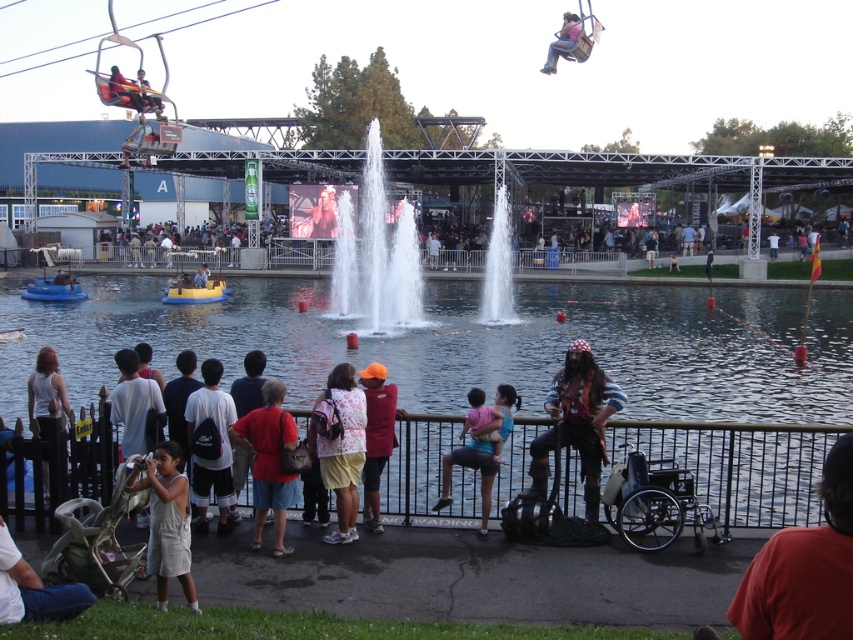
Does light beige overalls at lower left appear on the right side of matte pink shirt at upper center?

In fact, light beige overalls at lower left is to the left of matte pink shirt at upper center.

Which is behind, point (189, 541) or point (553, 68)?

Positioned behind is point (553, 68).

I want to click on light beige overalls at lower left, so click(x=166, y=522).

Can you confirm if white fabric backpack at center is smaller than smooth skin face at center?

Yes.

Based on the photo, who is positioned more to the right, white fabric backpack at center or smooth skin face at center?

Positioned to the right is white fabric backpack at center.

Between point (233, 508) and point (334, 195), which one is positioned behind?

Point (334, 195)

Identify the location of white fabric backpack at center. (212, 445).

Is orange fabric vest at center further to camera compared to light blue shirt at center?

No, it is in front of light blue shirt at center.

Does point (378, 502) come farther from viewer compared to point (202, 285)?

No, it is not.

What do you see at coordinates (376, 436) in the screenshot?
I see `orange fabric vest at center` at bounding box center [376, 436].

You are a GUI agent. You are given a task and a screenshot of the screen. Output one action in this format:
    pyautogui.click(x=<x>, y=<y>)
    Task: Click on the orange fabric vest at center
    This screenshot has height=640, width=853.
    Given the screenshot: What is the action you would take?
    pyautogui.click(x=376, y=436)